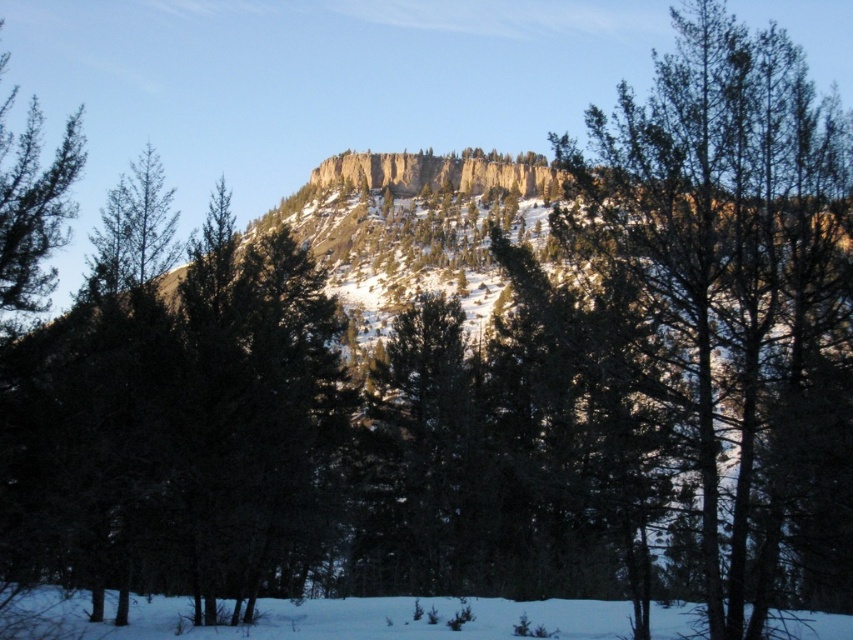
You are planning to place a small birdhouse between the green textured tree at center and the green matte tree at left. Based on their widths, which tree should the birdhouse be closer to?

The green textured tree at center has a smaller width than the green matte tree at left, so the birdhouse should be placed closer to the green textured tree at center to ensure enough space between them.

You are an observer standing in front of the winter landscape. You notice two trees in the scene. Which one is taller between the green textured tree at center and the green matte tree at left?

The green textured tree at center is taller than the green matte tree at left.